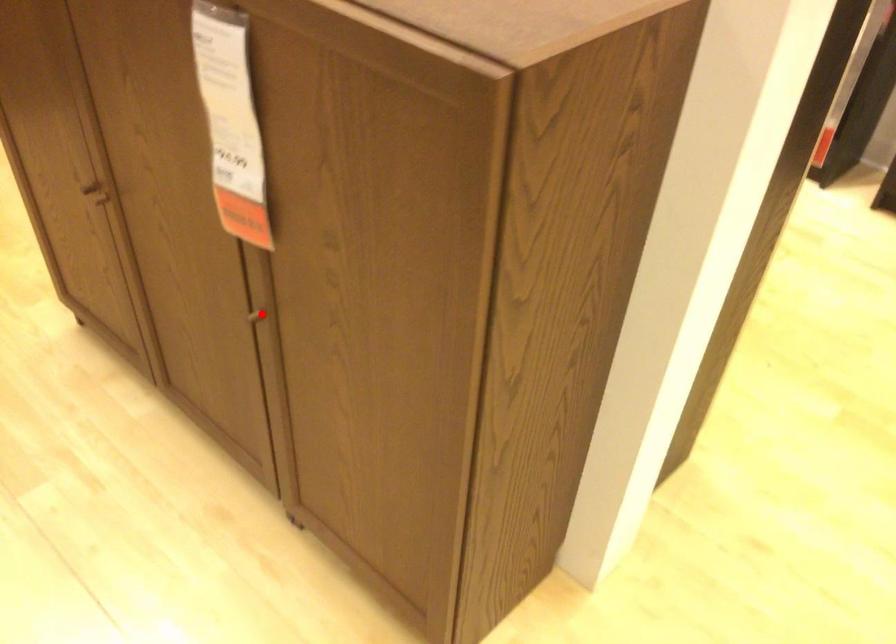
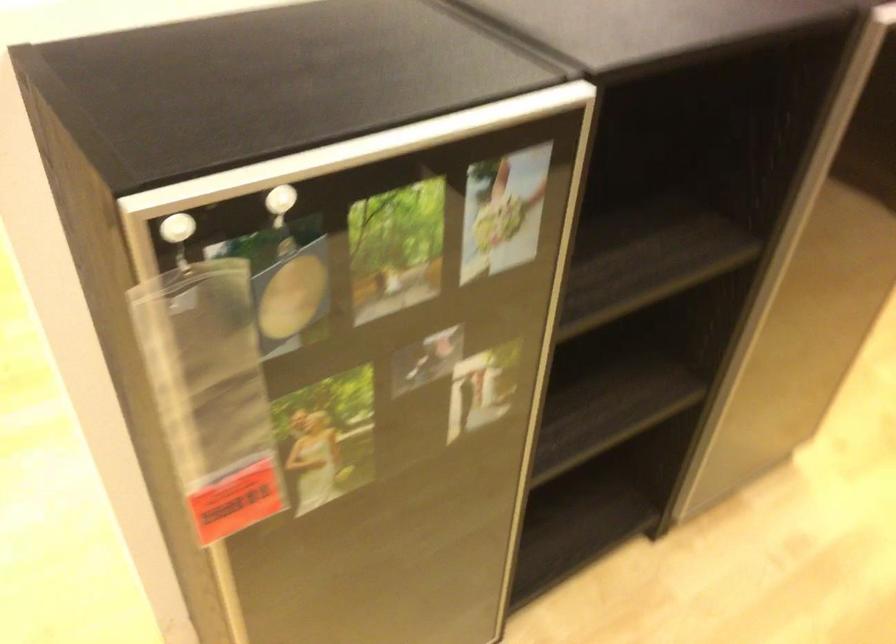
Question: I am providing you with two images of the same scene from different viewpoints. A red point is marked on the first image. Can you still see the location of the red point in image 2?

Choices:
 (A) Yes
 (B) No

Answer: (B)